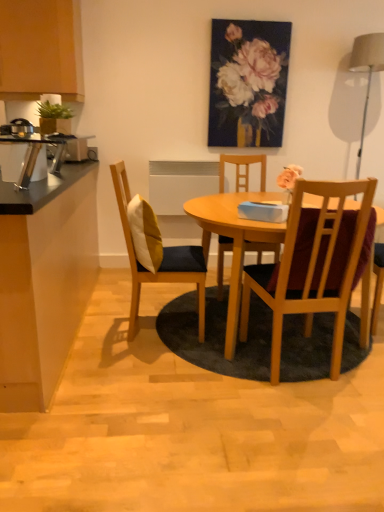
Locate an element on the screen. This screenshot has width=384, height=512. vacant area that is in front of wooden chair with cushion at center, which is counted as the first chair, starting from the left is located at coordinates (139, 364).